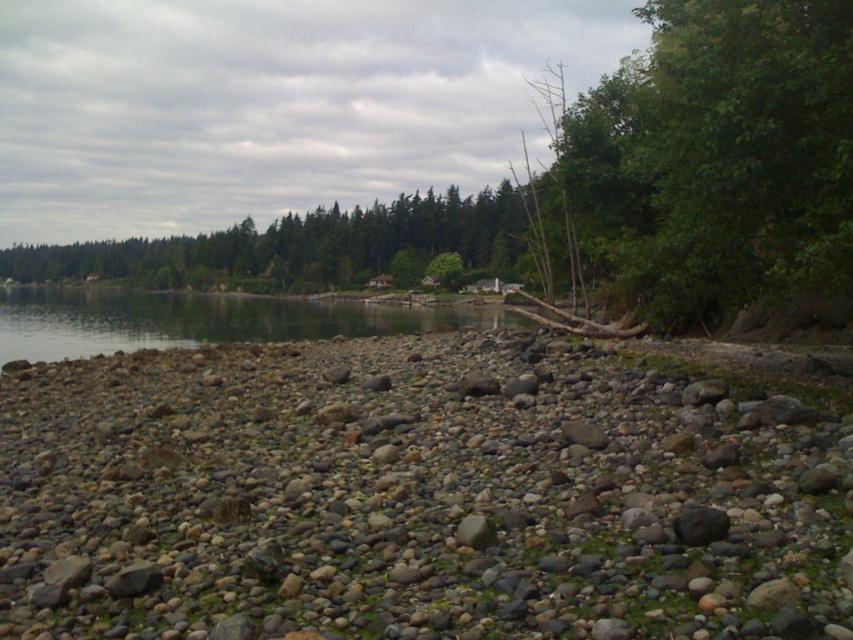
Question: Is gray/rocky pebbles at center above green leafy tree at right?

Choices:
 (A) no
 (B) yes

Answer: (A)

Question: Is gray/rocky pebbles at center further to camera compared to clear water at center?

Choices:
 (A) yes
 (B) no

Answer: (B)

Question: Does gray/rocky pebbles at center come behind green leafy tree at right?

Choices:
 (A) no
 (B) yes

Answer: (A)

Question: Estimate the real-world distances between objects in this image. Which object is closer to the gray/rocky pebbles at center?

Choices:
 (A) clear water at center
 (B) green leafy tree at right

Answer: (B)

Question: Which object is farther from the camera taking this photo?

Choices:
 (A) green leafy tree at right
 (B) gray/rocky pebbles at center

Answer: (A)

Question: Which object is farther from the camera taking this photo?

Choices:
 (A) gray/rocky pebbles at center
 (B) clear water at center
 (C) green leafy tree at right

Answer: (B)